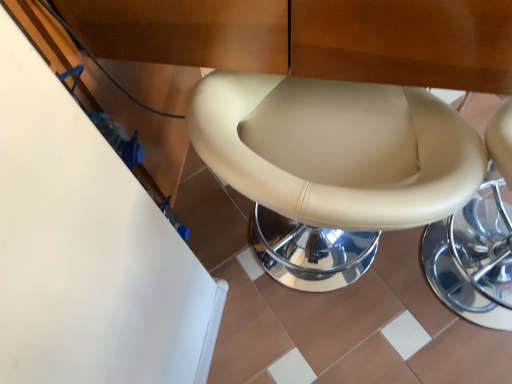
Question: Can you confirm if beige leather bar stool at center is positioned to the right of beige leather toilet at center?

Choices:
 (A) no
 (B) yes

Answer: (B)

Question: Considering the relative positions of beige leather bar stool at center and beige leather toilet at center in the image provided, is beige leather bar stool at center to the left of beige leather toilet at center from the viewer's perspective?

Choices:
 (A) no
 (B) yes

Answer: (A)

Question: Is beige leather toilet at center located within beige leather bar stool at center?

Choices:
 (A) no
 (B) yes

Answer: (A)

Question: Considering the relative sizes of beige leather bar stool at center and beige leather toilet at center in the image provided, is beige leather bar stool at center smaller than beige leather toilet at center?

Choices:
 (A) yes
 (B) no

Answer: (A)

Question: Is beige leather bar stool at center located outside beige leather toilet at center?

Choices:
 (A) no
 (B) yes

Answer: (B)

Question: Is beige leather bar stool at center thinner than beige leather toilet at center?

Choices:
 (A) yes
 (B) no

Answer: (A)

Question: Considering the relative positions of beige leather toilet at center and beige leather bar stool at center in the image provided, is beige leather toilet at center to the right of beige leather bar stool at center from the viewer's perspective?

Choices:
 (A) no
 (B) yes

Answer: (A)

Question: Would you say beige leather toilet at center is a long distance from beige leather bar stool at center?

Choices:
 (A) yes
 (B) no

Answer: (B)

Question: Does beige leather toilet at center have a larger size compared to beige leather bar stool at center?

Choices:
 (A) yes
 (B) no

Answer: (A)

Question: Is beige leather bar stool at center located within beige leather toilet at center?

Choices:
 (A) no
 (B) yes

Answer: (A)

Question: Is the position of beige leather toilet at center more distant than that of beige leather bar stool at center?

Choices:
 (A) no
 (B) yes

Answer: (A)

Question: Is beige leather toilet at center smaller than beige leather bar stool at center?

Choices:
 (A) no
 (B) yes

Answer: (A)

Question: In terms of size, does beige leather bar stool at center appear bigger or smaller than beige leather toilet at center?

Choices:
 (A) big
 (B) small

Answer: (B)